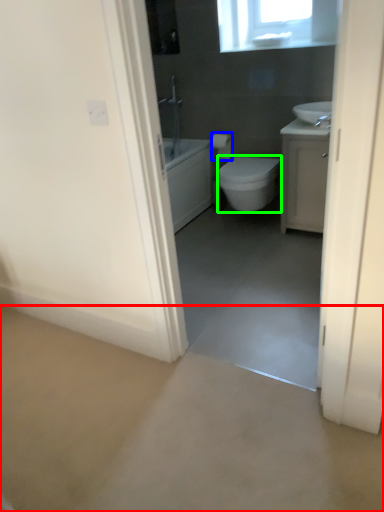
Question: Which object is the farthest from concrete (highlighted by a red box)? Choose among these: toilet paper (highlighted by a blue box) or bidet (highlighted by a green box).

Choices:
 (A) toilet paper
 (B) bidet

Answer: (A)